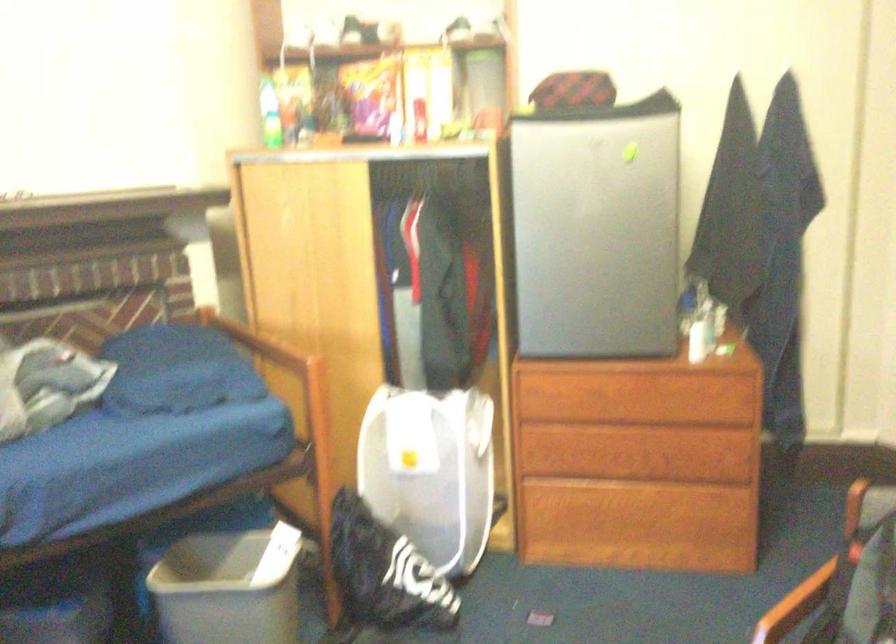
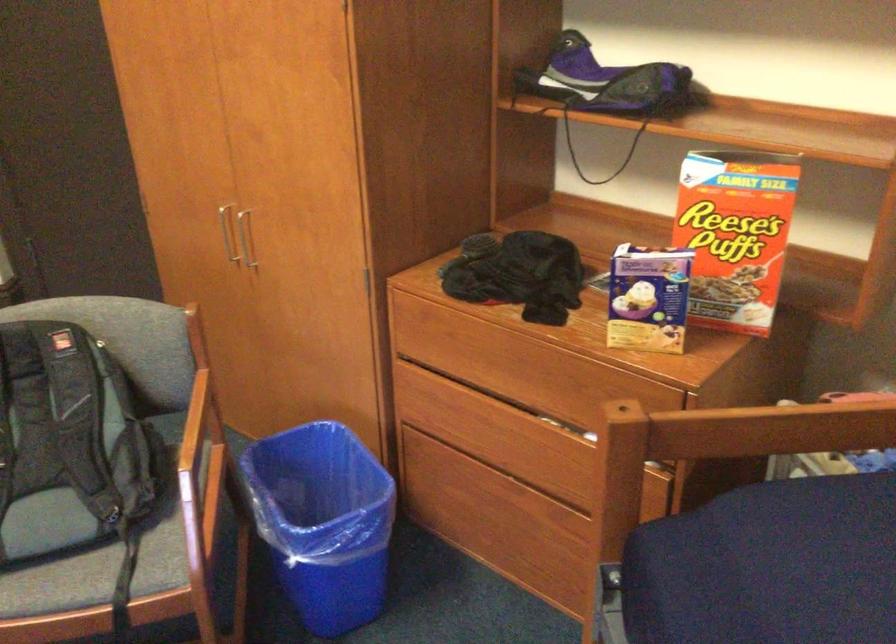
First-person continuous shooting, in which direction is the camera rotating?

The camera's rotation is toward right-down.